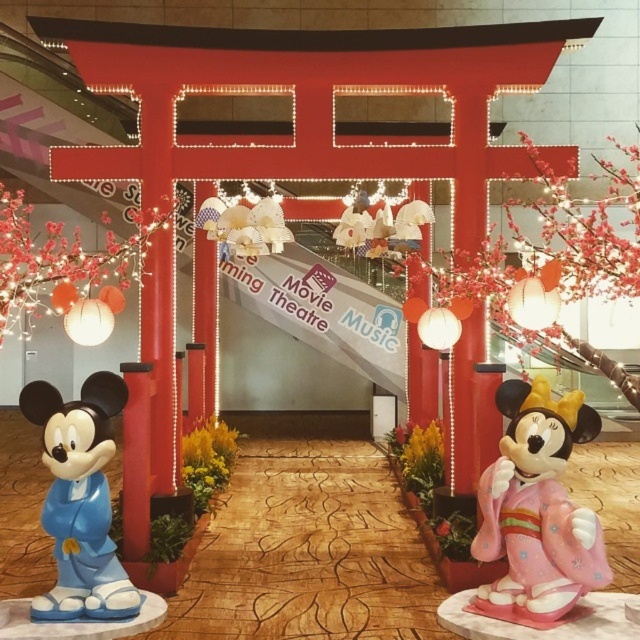
You are planning to place a new decorative item between the pink glossy minnie mouse statue at right and the matte blue plastic mickey mouse at left. Based on their widths, which side should the item be placed closer to ensure it doesn

The pink glossy minnie mouse statue at right is wider than the matte blue plastic mickey mouse at left. To ensure the new item fits appropriately, it should be placed closer to the side of the matte blue plastic mickey mouse at left since there is more space available there due to the narrower width of that statue.

You are standing at the entrance of the movie theater and want to move towards the back of the scene. Which point, point (477,547) or point (38,400), would you reach first?

You would reach point (38,400) first because it is closer to you than point (477,547), which is further back in the scene.

You are standing at the entrance of the movie theater and see the pink glossy minnie mouse statue at right and the matte blue plastic mickey mouse at left. Which of these two statues is closer to you?

The pink glossy minnie mouse statue at right is closer to you because it is in front of the matte blue plastic mickey mouse at left.